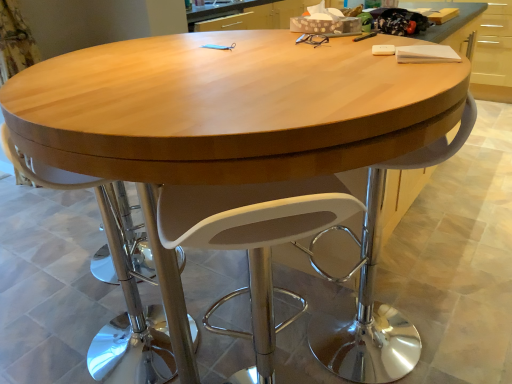
Identify the location of vacant space behind white plastic swivel chair at center. (249, 345).